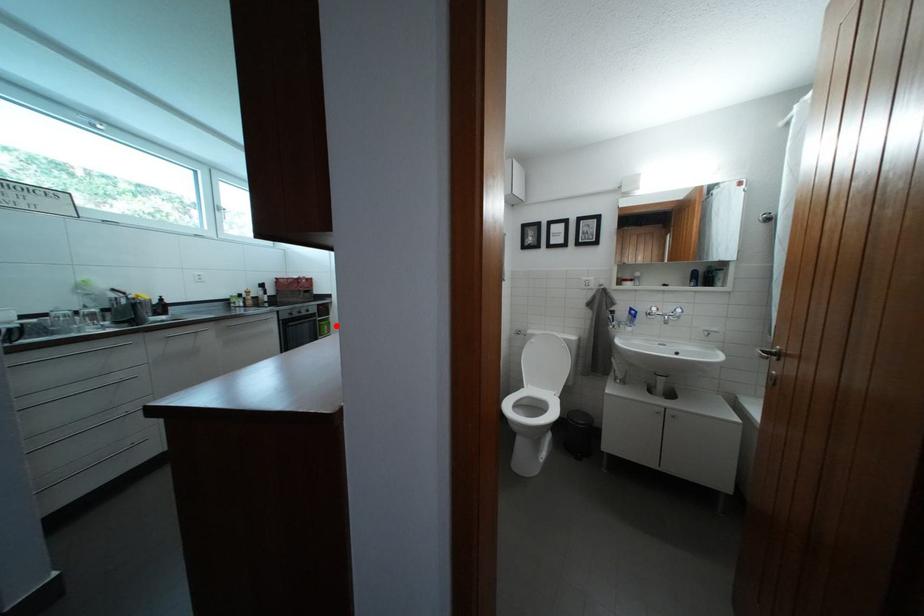
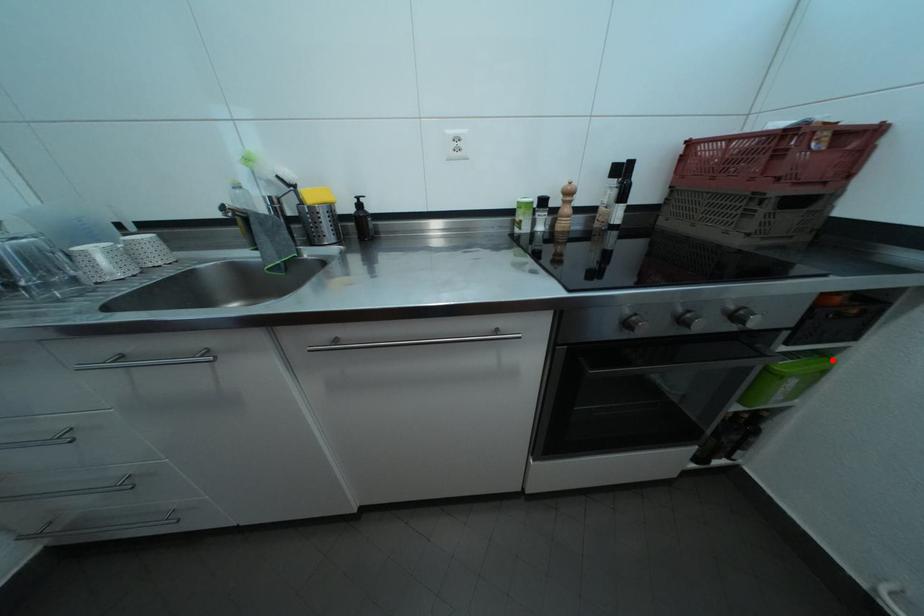
I am providing you with two images of the same scene from different viewpoints. A red point is marked on the first image and another point is marked on the second image. Are the points marked in image1 and image2 representing the same 3D position?

Yes